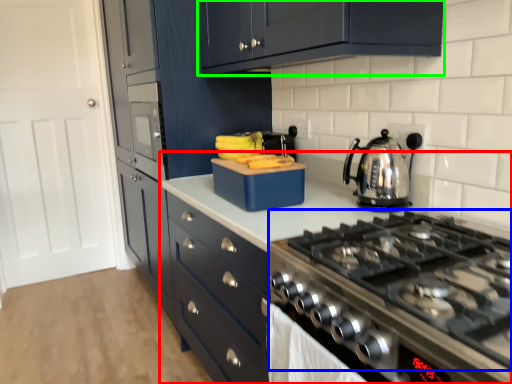
Question: Estimate the real-world distances between objects in this image. Which object is farther from countertop (highlighted by a red box), gas stove (highlighted by a blue box) or cabinetry (highlighted by a green box)?

Choices:
 (A) gas stove
 (B) cabinetry

Answer: (B)